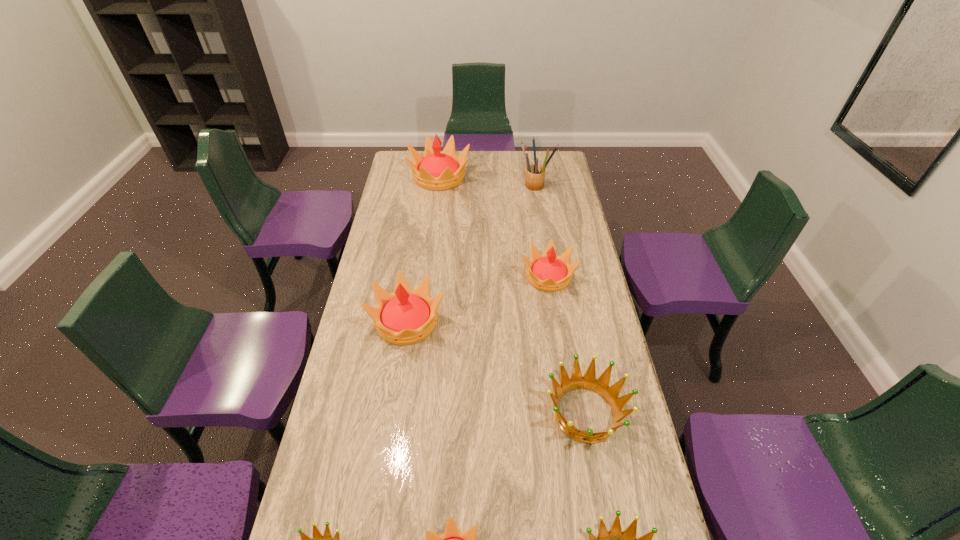
Find the location of a particular element. vacant space positioned on the front of the brown pencil box is located at coordinates (542, 225).

At what (x,y) coordinates should I click in order to perform the action: click on free space located 0.150m on the back of the sixth shortest object. Please return your answer as a coordinate pair (x, y). Looking at the image, I should click on (416, 266).

Identify the location of free spot located 0.060m on the right of the fifth shortest object. The width and height of the screenshot is (960, 540). tap(591, 277).

This screenshot has height=540, width=960. What are the coordinates of `vacant space located on the front of the biggest golden crown` in the screenshot? It's located at (608, 535).

Where is `object located in the far edge section of the desktop`? object located in the far edge section of the desktop is located at coordinates (435, 170).

Where is `pencil box that is at the right edge`? This screenshot has width=960, height=540. pencil box that is at the right edge is located at coordinates (535, 174).

Where is `object that is positioned at the far left corner`? object that is positioned at the far left corner is located at coordinates (435, 170).

Find the location of a particular element. vacant area at the far edge is located at coordinates (468, 155).

In the image, there is a desktop. Find the location of `free region at the left edge`. free region at the left edge is located at coordinates (372, 335).

The width and height of the screenshot is (960, 540). In the image, there is a desktop. What are the coordinates of `free region at the right edge` in the screenshot? It's located at (567, 193).